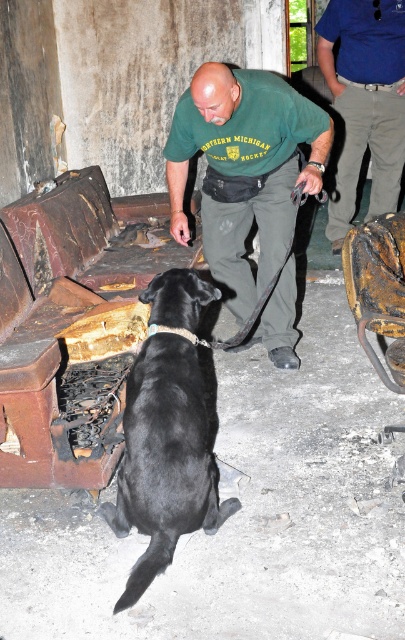
You are a person looking at the scene. There are two shirts in the image. The first is a green fabric shirt at center and the second is a blue cotton shirt at upper right. Which shirt is positioned more to the left side of the image?

The green fabric shirt at center is positioned to the left of the blue cotton shirt at upper right, so the green fabric shirt at center is more to the left side of the image.

Consider the image. You are a photographer trying to capture the scene of the black smooth fur dog at center sniffing the burnt sofa. You want to ensure the green fabric shirt at center is visible in the frame. Based on their positions, should you pan your camera to the left or right to include both subjects?

The green fabric shirt at center is to the right of the black smooth fur dog at center. To include both subjects in the frame, you should pan the camera to the right to capture the green fabric shirt at center and the black smooth fur dog at center.

You are a fashion designer analyzing clothing items in the scene. You need to determine which shirt, the green fabric shirt at center or the blue cotton shirt at upper right, has a larger width. What is your conclusion?

The green fabric shirt at center is wider than the blue cotton shirt at upper right according to the description.